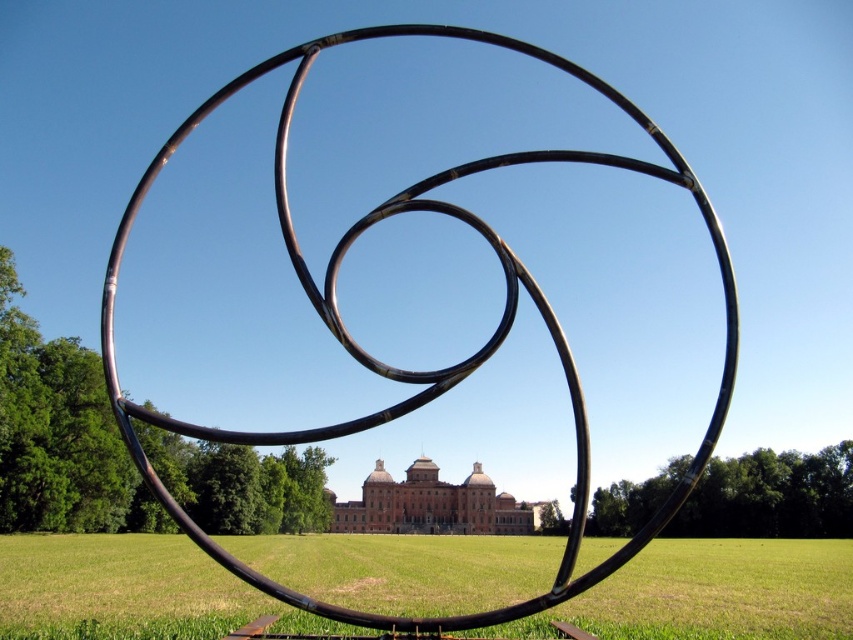
Which is more to the left, green grass at center or polished metal rings at center?

polished metal rings at center is more to the left.

Who is shorter, green grass at center or polished metal rings at center?

Standing shorter between the two is green grass at center.

Is point (450, 548) in front of point (537, 157)?

No, it is not.

Where is `green grass at center`? The width and height of the screenshot is (853, 640). green grass at center is located at coordinates (718, 593).